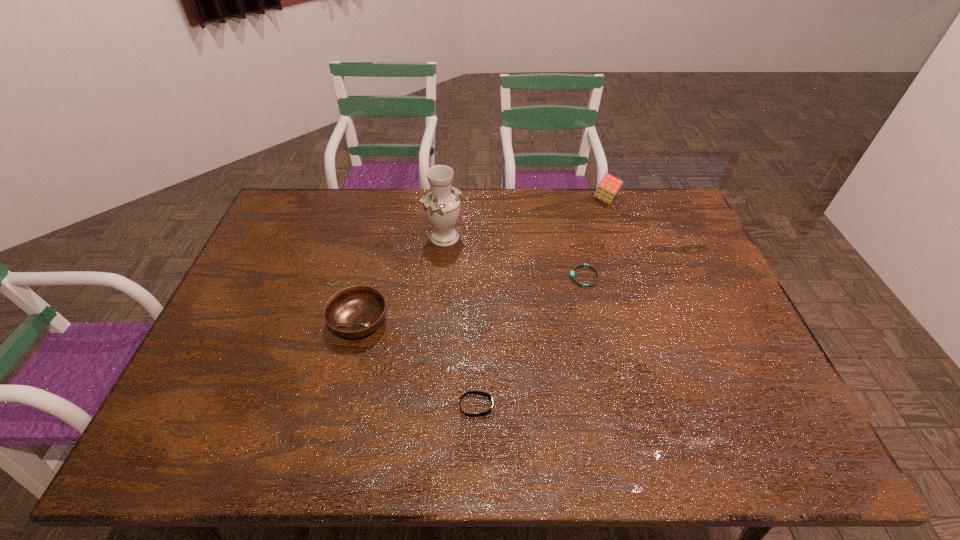
Locate an element on the screen. the second object from left to right is located at coordinates (442, 205).

Find the location of a particular element. the fourth nearest object is located at coordinates (442, 205).

The image size is (960, 540). In order to click on the fourth shortest object in this screenshot , I will do `click(609, 186)`.

The width and height of the screenshot is (960, 540). Find the location of `cube`. cube is located at coordinates [609, 186].

I want to click on soup bowl, so click(356, 311).

The width and height of the screenshot is (960, 540). What are the coordinates of `the second nearest object` in the screenshot? It's located at (356, 311).

Find the location of a particular element. This screenshot has height=540, width=960. the fourth tallest object is located at coordinates (469, 392).

This screenshot has height=540, width=960. What are the coordinates of `the nearer wristband` in the screenshot? It's located at (469, 392).

Identify the location of the right wristband. (580, 265).

The width and height of the screenshot is (960, 540). Identify the location of the third nearest object. (580, 265).